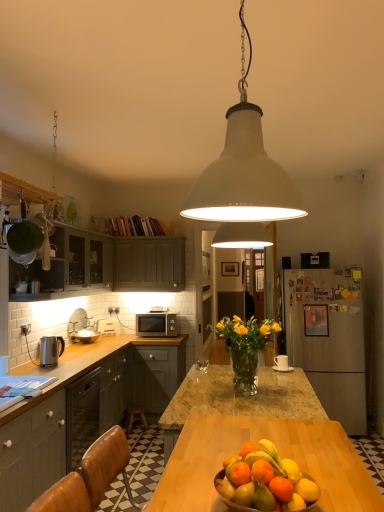
Question: Does orange matte citrus at center, placed as the 2th citrus fruit when sorted from right to left, have a lesser height compared to matte gray cabinets at left, the fourth cabinetry positioned from the top?

Choices:
 (A) no
 (B) yes

Answer: (B)

Question: From a real-world perspective, does orange matte citrus at center, the 1th citrus fruit when ordered from left to right, sit lower than matte gray cabinets at left, which is the first cabinetry in bottom-to-top order?

Choices:
 (A) yes
 (B) no

Answer: (B)

Question: Considering the relative sizes of orange matte citrus at center, the 1th citrus fruit when ordered from left to right, and matte gray cabinets at left, which is the first cabinetry in bottom-to-top order, in the image provided, is orange matte citrus at center, the 1th citrus fruit when ordered from left to right, taller than matte gray cabinets at left, which is the first cabinetry in bottom-to-top order,?

Choices:
 (A) yes
 (B) no

Answer: (B)

Question: Is orange matte citrus at center, the 1th citrus fruit when ordered from left to right, positioned before matte gray cabinets at left, which is the first cabinetry in bottom-to-top order?

Choices:
 (A) no
 (B) yes

Answer: (B)

Question: Does orange matte citrus at center, the 1th citrus fruit when ordered from left to right, come behind matte gray cabinets at left, the fourth cabinetry positioned from the top?

Choices:
 (A) no
 (B) yes

Answer: (A)

Question: Is orange matte citrus at center, placed as the 2th citrus fruit when sorted from right to left, turned away from matte gray cabinets at left, the fourth cabinetry positioned from the top?

Choices:
 (A) yes
 (B) no

Answer: (B)

Question: Is orange matte citrus at center, the 1th citrus fruit when ordered from left to right, taller than white matte pendant light at center?

Choices:
 (A) yes
 (B) no

Answer: (B)

Question: Does orange matte citrus at center, placed as the 2th citrus fruit when sorted from right to left, have a smaller size compared to white matte pendant light at center?

Choices:
 (A) no
 (B) yes

Answer: (B)

Question: Is orange matte citrus at center, marked as the 1th citrus fruit in a front-to-back arrangement, completely or partially outside of white matte pendant light at center?

Choices:
 (A) yes
 (B) no

Answer: (A)

Question: Is orange matte citrus at center, marked as the 1th citrus fruit in a front-to-back arrangement, at the left side of white matte pendant light at center?

Choices:
 (A) yes
 (B) no

Answer: (B)

Question: Is the position of orange matte citrus at center, the 2th citrus fruit in the back-to-front sequence, more distant than that of white matte pendant light at center?

Choices:
 (A) yes
 (B) no

Answer: (B)

Question: Is orange matte citrus at center, the 1th citrus fruit when ordered from left to right, surrounding white matte pendant light at center?

Choices:
 (A) no
 (B) yes

Answer: (A)

Question: Is orange matte fruit at center to the left of matte gray cabinets at upper left, the first cabinetry in the top-to-bottom sequence, from the viewer's perspective?

Choices:
 (A) no
 (B) yes

Answer: (A)